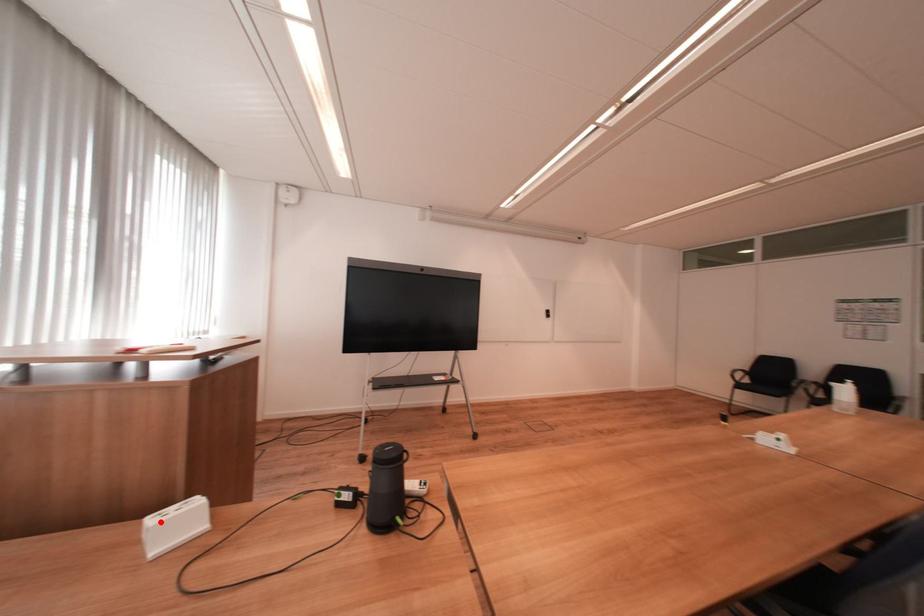
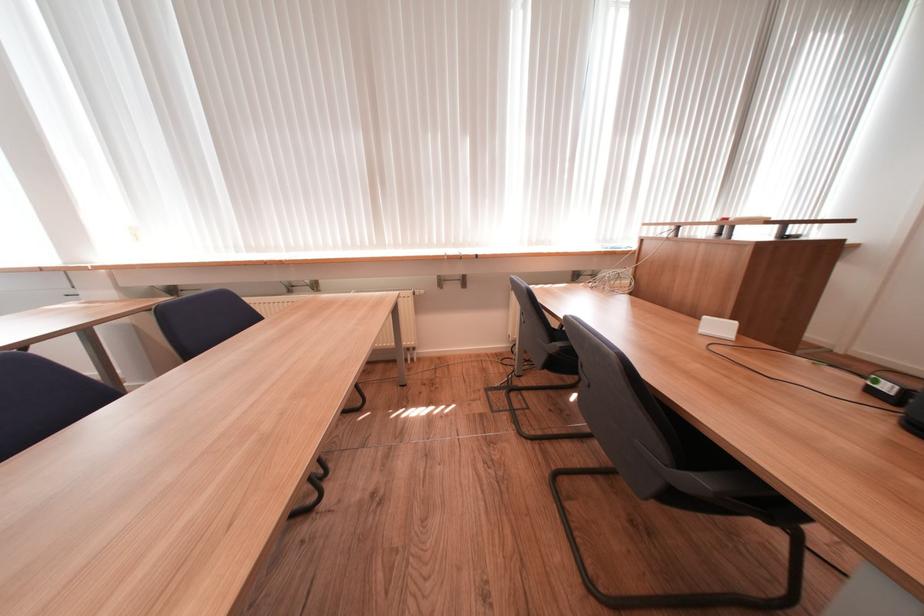
Where in the second image is the point corresponding to the highlighted location from the first image?

(713, 320)